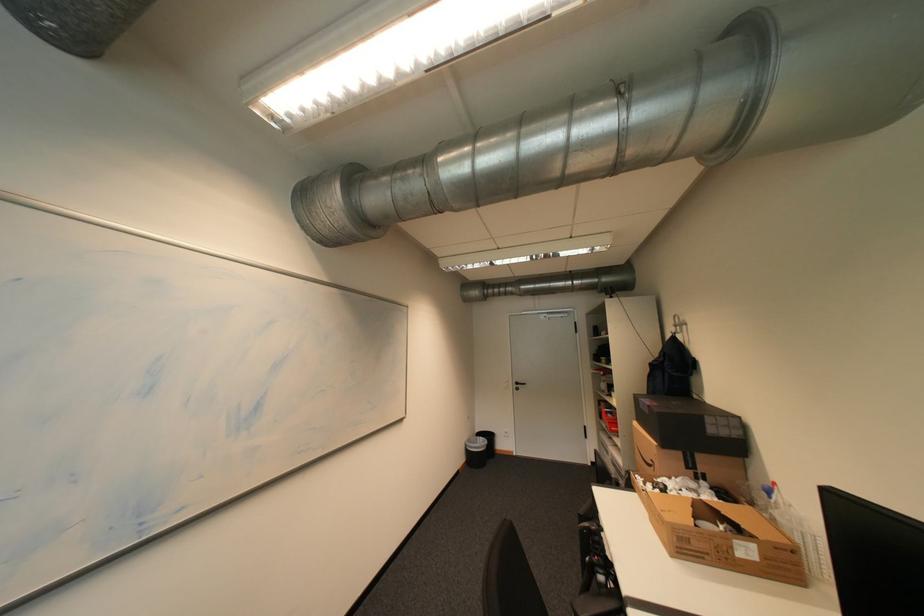
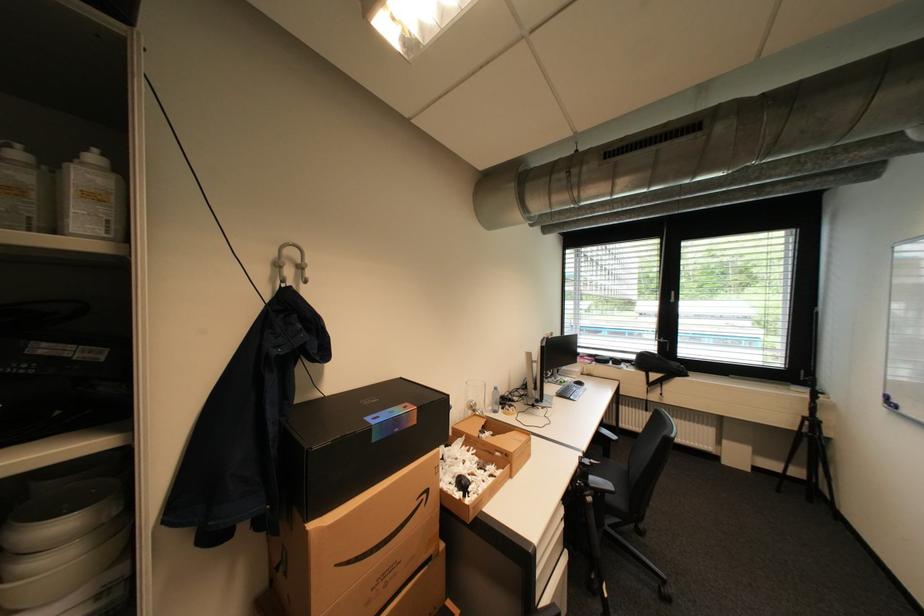
Locate, in the second image, the point that corresponds to point 662,464 in the first image.

(433, 496)